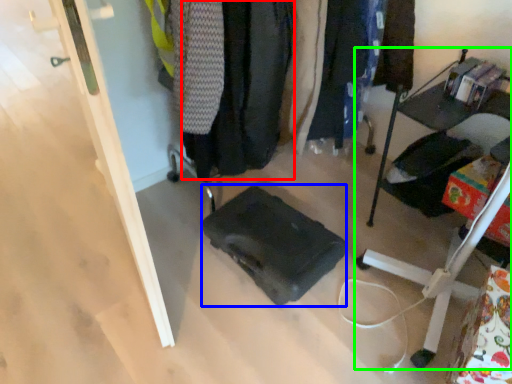
Question: Based on their relative distances, which object is farther from clothing (highlighted by a red box)? Choose from luggage (highlighted by a blue box) and furniture (highlighted by a green box).

Choices:
 (A) luggage
 (B) furniture

Answer: (B)